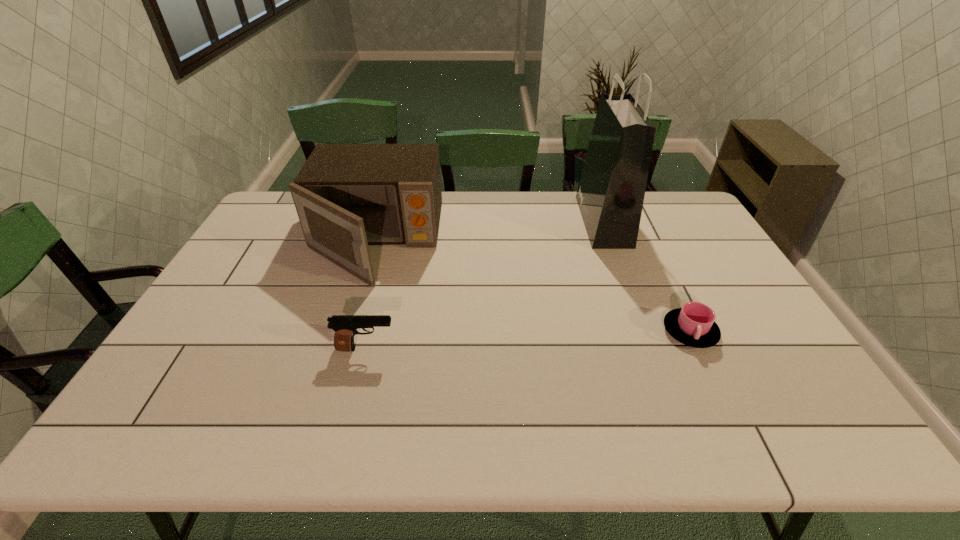
Locate an element on the screen. Image resolution: width=960 pixels, height=540 pixels. shopping bag is located at coordinates (610, 195).

Where is `the second tallest object`? the second tallest object is located at coordinates (347, 196).

You are a GUI agent. You are given a task and a screenshot of the screen. Output one action in this format:
    pyautogui.click(x=<x>, y=<y>)
    Task: Click on the pistol
    The height and width of the screenshot is (540, 960).
    Given the screenshot: What is the action you would take?
    pyautogui.click(x=345, y=326)

You are a GUI agent. You are given a task and a screenshot of the screen. Output one action in this format:
    pyautogui.click(x=<x>, y=<y>)
    Task: Click on the cup
    The height and width of the screenshot is (540, 960).
    Given the screenshot: What is the action you would take?
    pyautogui.click(x=694, y=325)

This screenshot has width=960, height=540. In order to click on free space located 0.290m on the front with handles of the tallest object in this screenshot , I will do `click(501, 221)`.

You are a GUI agent. You are given a task and a screenshot of the screen. Output one action in this format:
    pyautogui.click(x=<x>, y=<y>)
    Task: Click on the vacant space located 0.320m on the front with handles of the tallest object
    The height and width of the screenshot is (540, 960).
    Given the screenshot: What is the action you would take?
    pyautogui.click(x=492, y=221)

Locate an element on the screen. This screenshot has width=960, height=540. vacant region located on the front with handles of the tallest object is located at coordinates point(504,221).

The height and width of the screenshot is (540, 960). Find the location of `free space located with the door open on the front of the microwave oven`. free space located with the door open on the front of the microwave oven is located at coordinates (323, 413).

The width and height of the screenshot is (960, 540). I want to click on blank area located 0.050m at the barrel of the third tallest object, so click(x=416, y=349).

You are a GUI agent. You are given a task and a screenshot of the screen. Output one action in this format:
    pyautogui.click(x=<x>, y=<y>)
    Task: Click on the free region located on the side with the handle of the cup
    The width and height of the screenshot is (960, 540).
    Given the screenshot: What is the action you would take?
    pyautogui.click(x=718, y=389)